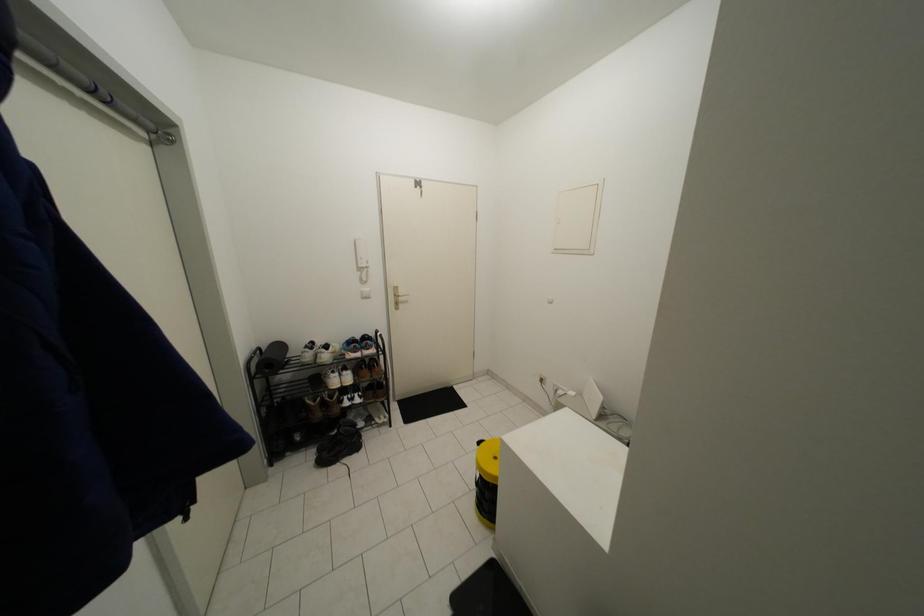
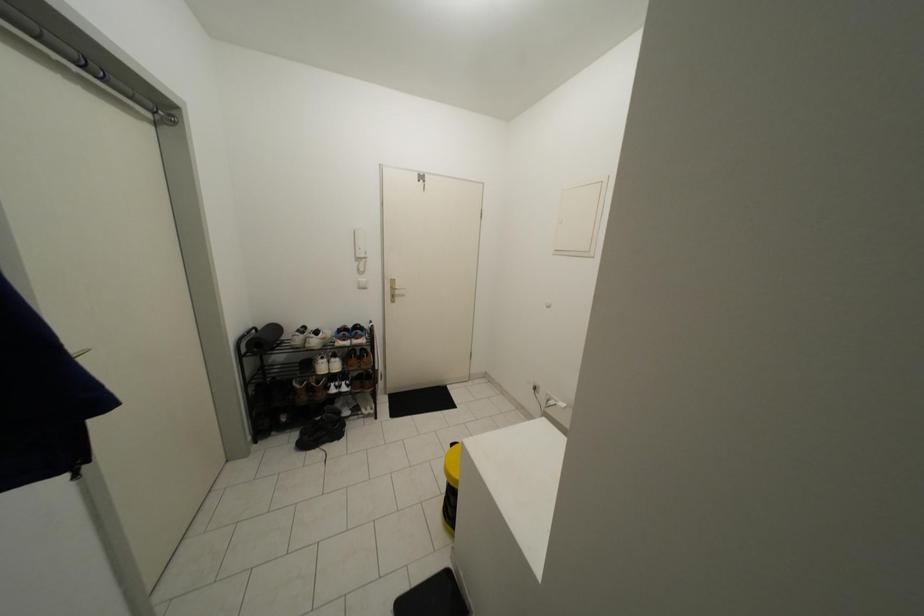
Question: Which direction would the cameraman need to move to produce the second image? Reply with the corresponding letter.

Choices:
 (A) Left
 (B) Right
 (C) Forward
 (D) Backward

Answer: (B)